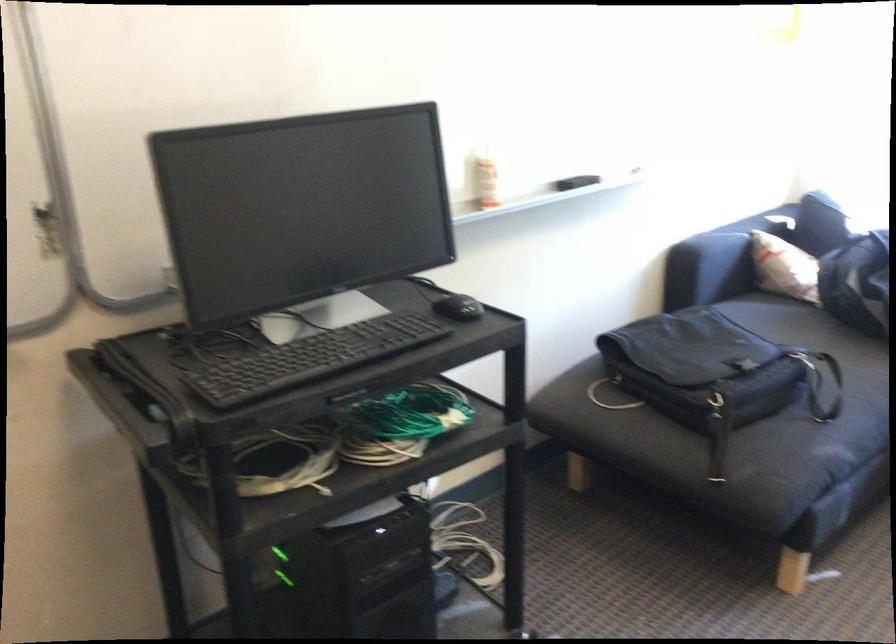
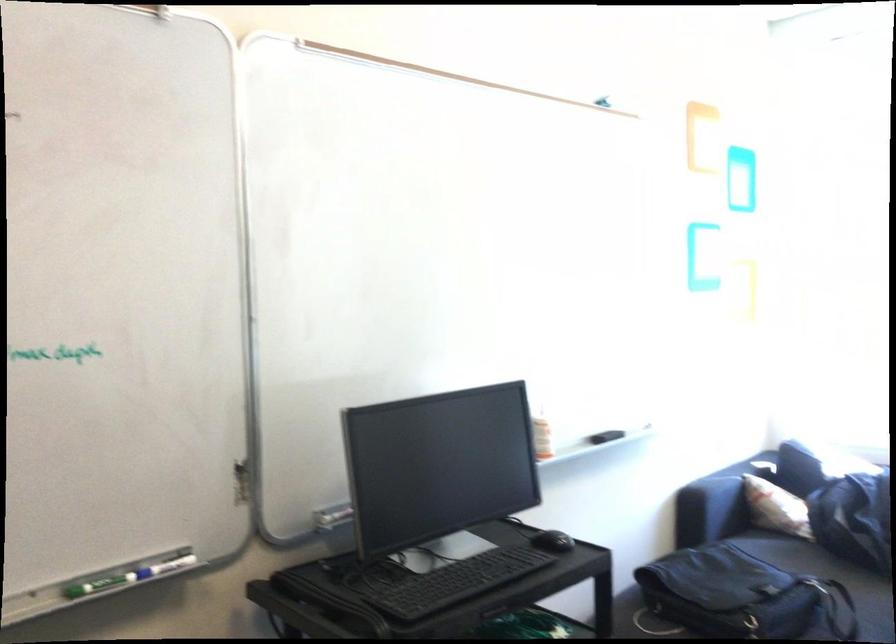
In the second image, find the point that corresponds to point 710,370 in the first image.

(744, 596)